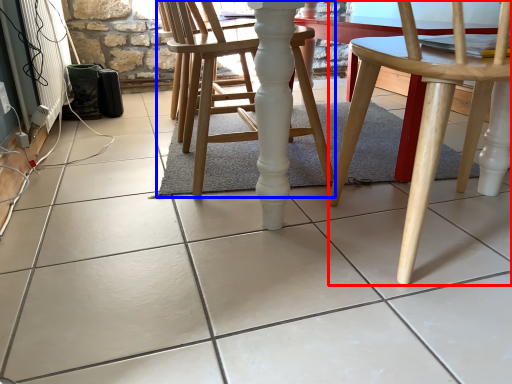
Question: Among these objects, which one is farthest to the camera, chair (highlighted by a red box) or chair (highlighted by a blue box)?

Choices:
 (A) chair
 (B) chair

Answer: (B)